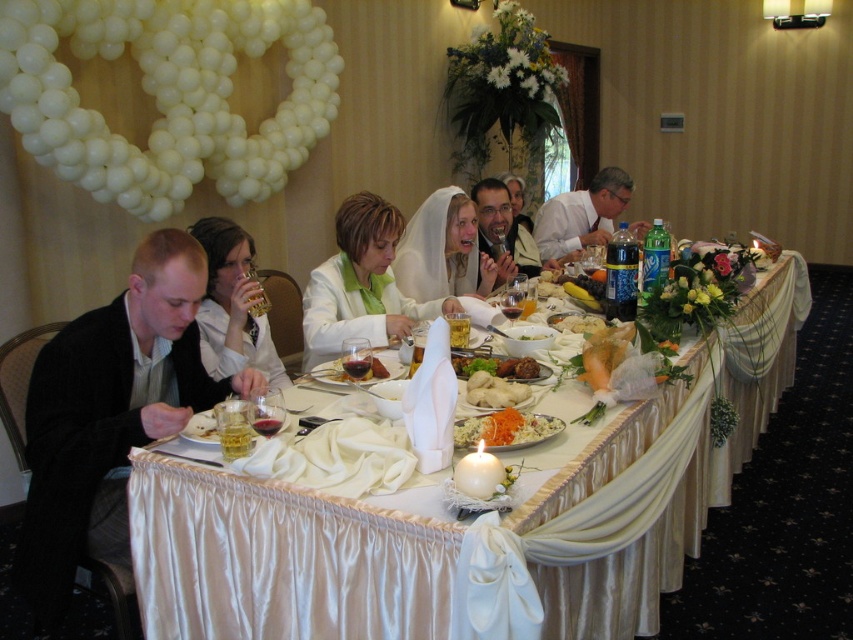
You are a guest at the wedding reception and want to place your napkin on the table. You see two points marked on the table. The first point is at coordinate point (x=105, y=515) and the second point is at coordinate point (x=490, y=202). If you want to place your napkin closer to the front of the table, which coordinate point should you choose?

You should choose point (x=105, y=515) because it is in front of point (x=490, y=202), so placing your napkin there would be closer to the front of the table.